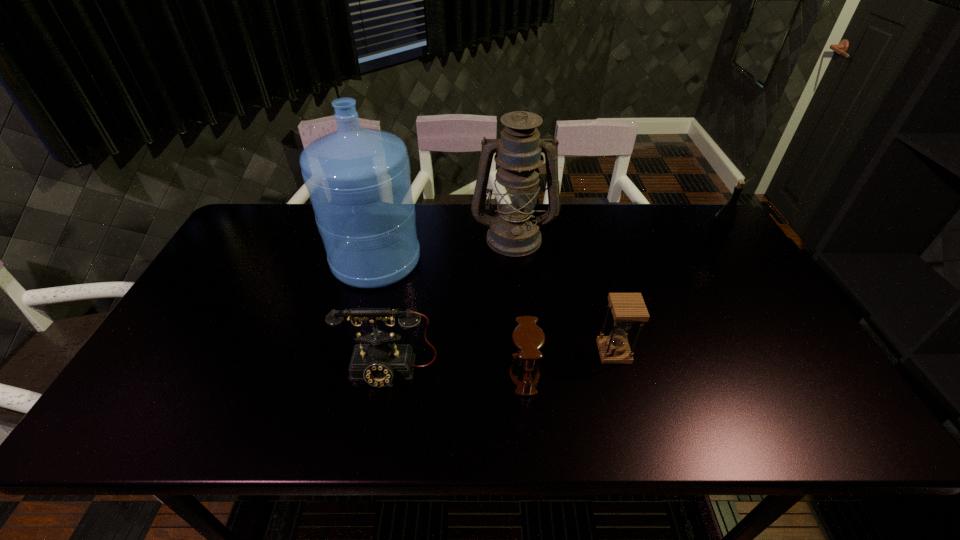
At what (x,y) coordinates should I click in order to perform the action: click on water jug. Please return your answer as a coordinate pair (x, y). This screenshot has height=540, width=960. Looking at the image, I should click on (358, 179).

At what (x,y) coordinates should I click in order to perform the action: click on the second tallest object. Please return your answer as a coordinate pair (x, y). The image size is (960, 540). Looking at the image, I should click on (514, 231).

Identify the location of the rightmost object. The height and width of the screenshot is (540, 960). pyautogui.click(x=723, y=222).

Locate an element on the screen. This screenshot has width=960, height=540. telephone is located at coordinates (378, 363).

At what (x,y) coordinates should I click in order to perform the action: click on the fifth object from left to right. Please return your answer as a coordinate pair (x, y). The image size is (960, 540). Looking at the image, I should click on (627, 308).

Where is `the taller hourglass`? The image size is (960, 540). the taller hourglass is located at coordinates (627, 308).

Locate an element on the screen. Image resolution: width=960 pixels, height=540 pixels. the left hourglass is located at coordinates (528, 338).

Locate an element on the screen. This screenshot has height=540, width=960. the shorter hourglass is located at coordinates 528,338.

Image resolution: width=960 pixels, height=540 pixels. I want to click on vacant space positioned on the side of the water jug with the handle, so click(388, 215).

The image size is (960, 540). Find the location of `free region located on the right of the oil lamp`. free region located on the right of the oil lamp is located at coordinates (617, 237).